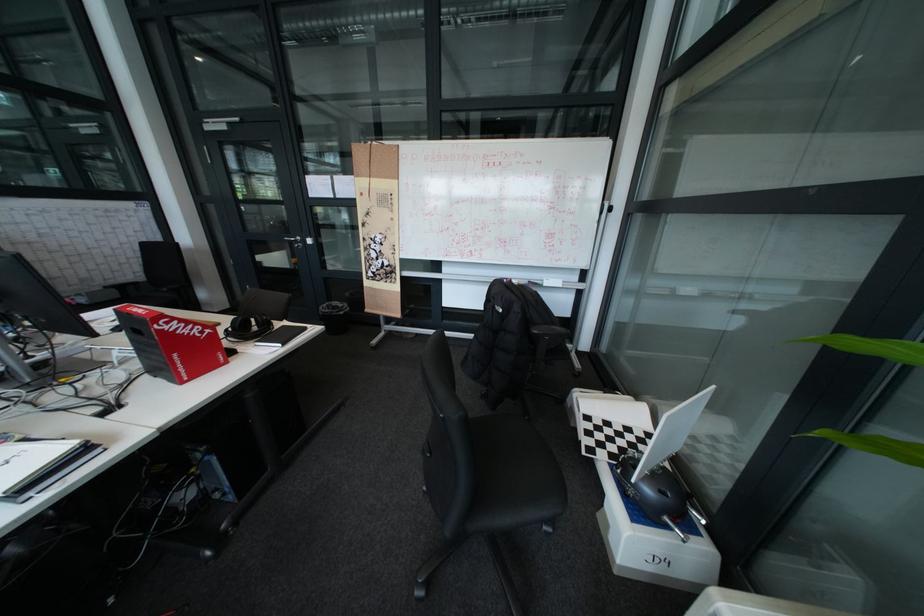
At what (x,y) coordinates should I click in order to perform the action: click on silver door handle. Please return your answer as a coordinate pair (x, y). This screenshot has height=616, width=924. Looking at the image, I should click on (295, 241).